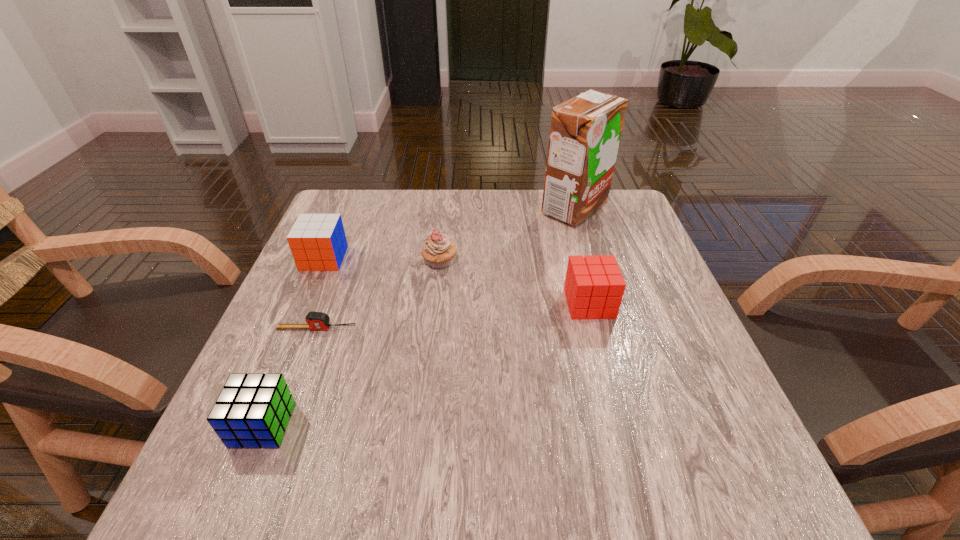
Where is `object that stands as the fourth closest to the fifth farthest object`? object that stands as the fourth closest to the fifth farthest object is located at coordinates (594, 286).

Identify the location of the closest cube relative to the nearest object. Image resolution: width=960 pixels, height=540 pixels. (317, 242).

Where is `cube that can be found as the closest to the second nearest cube`? This screenshot has height=540, width=960. cube that can be found as the closest to the second nearest cube is located at coordinates (317, 242).

The image size is (960, 540). In order to click on free location that satisfies the following two spatial constraints: 1. on the front side of the farthest cube; 2. on the left side of the tape measure in this screenshot , I will do `click(294, 328)`.

Find the location of a particular element. Image resolution: width=960 pixels, height=540 pixels. blank space that satisfies the following two spatial constraints: 1. on the straw side of the carton; 2. on the front side of the farthest cube is located at coordinates (588, 258).

Identify the location of vacant region that satisfies the following two spatial constraints: 1. on the straw side of the tallest object; 2. on the front side of the nearest cube. (638, 425).